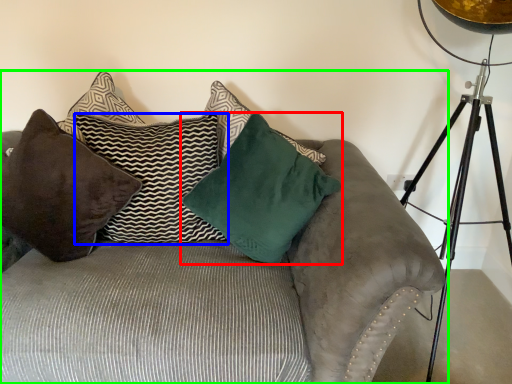
Question: Estimate the real-world distances between objects in this image. Which object is farther from pillow (highlighted by a red box), pillow (highlighted by a blue box) or studio couch (highlighted by a green box)?

Choices:
 (A) pillow
 (B) studio couch

Answer: (B)